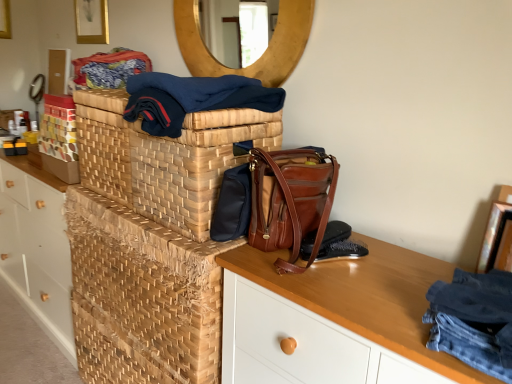
Question: Considering the positions of point (308, 246) and point (217, 231), is point (308, 246) closer or farther from the camera than point (217, 231)?

Choices:
 (A) farther
 (B) closer

Answer: (B)

Question: Do you think black leather shoe at lower right, acting as the first shoe starting from the top, is within shiny brown leather messenger bag at center, or outside of it?

Choices:
 (A) inside
 (B) outside

Answer: (B)

Question: Which object is positioned closest to the brown leather shoe at center, which ranks as the 1th shoe in bottom-to-top order?

Choices:
 (A) wooden desk at center
 (B) woven wood basket at center
 (C) navy blue fabric at upper center, the second clothing when ordered from right to left
 (D) black leather shoe at lower right, acting as the first shoe starting from the top
 (E) shiny brown leather messenger bag at center

Answer: (D)

Question: Estimate the real-world distances between objects in this image. Which object is closer to the shiny brown leather messenger bag at center?

Choices:
 (A) navy blue fabric at upper center, the 1th clothing viewed from the top
 (B) textured woven fabric at upper left
 (C) wooden desk at center
 (D) denim jeans at right, the 2th clothing in the left-to-right sequence
 (E) brown leather shoe at center, the second shoe in the top-to-bottom sequence

Answer: (A)